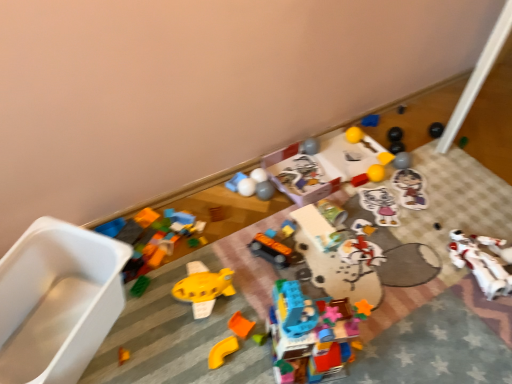
Locate an element on the screen. This screenshot has height=384, width=512. vacant area that is situated to the right of orange matte plastic toy at lower center, the fifteenth toy viewed from the right is located at coordinates (253, 357).